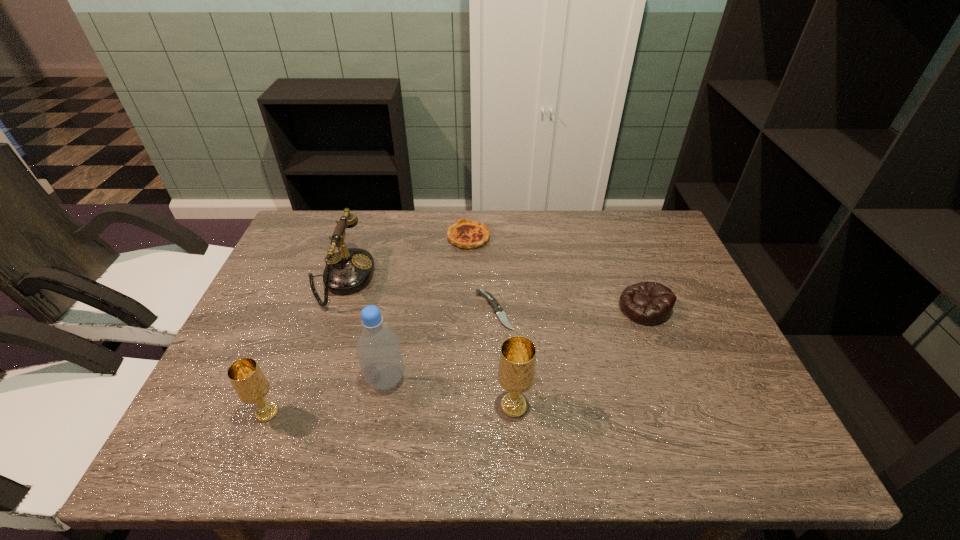
Where is `free space located 0.280m on the back of the right chalice`? free space located 0.280m on the back of the right chalice is located at coordinates (507, 300).

The width and height of the screenshot is (960, 540). What are the coordinates of `free location located 0.200m on the front of the sixth tallest object` in the screenshot? It's located at (467, 296).

The image size is (960, 540). I want to click on free region located on the front of the pocketknife, so click(497, 410).

The image size is (960, 540). I want to click on vacant space located 0.260m on the dial of the telephone, so click(x=465, y=279).

Find the location of a particular element. vacant space situated 0.100m on the back of the rightmost object is located at coordinates (629, 267).

Find the location of `vacant position located on the back of the bottle`. vacant position located on the back of the bottle is located at coordinates (407, 265).

The image size is (960, 540). I want to click on quiche positioned at the far edge, so click(467, 234).

Find the location of a particular element. This screenshot has width=960, height=540. telephone at the far edge is located at coordinates click(349, 270).

Identify the location of bottle situated at the near edge. This screenshot has width=960, height=540. (378, 349).

Identify the location of chalice present at the left edge. (249, 382).